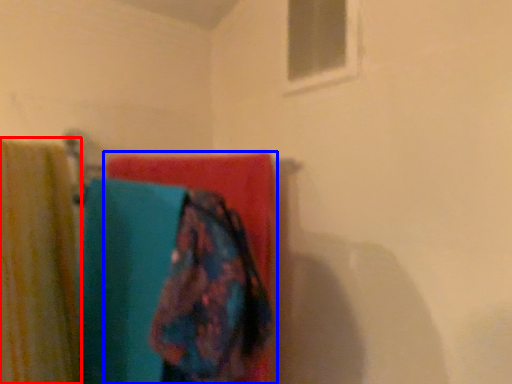
Question: Which of the following is the farthest to the observer, curtain (highlighted by a red box) or towel (highlighted by a blue box)?

Choices:
 (A) curtain
 (B) towel

Answer: (B)